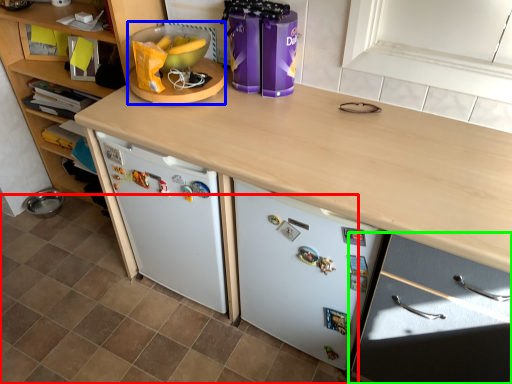
Question: Estimate the real-world distances between objects in this image. Which object is farther from tile (highlighted by a red box), appliance (highlighted by a blue box) or cabinetry (highlighted by a green box)?

Choices:
 (A) appliance
 (B) cabinetry

Answer: (A)